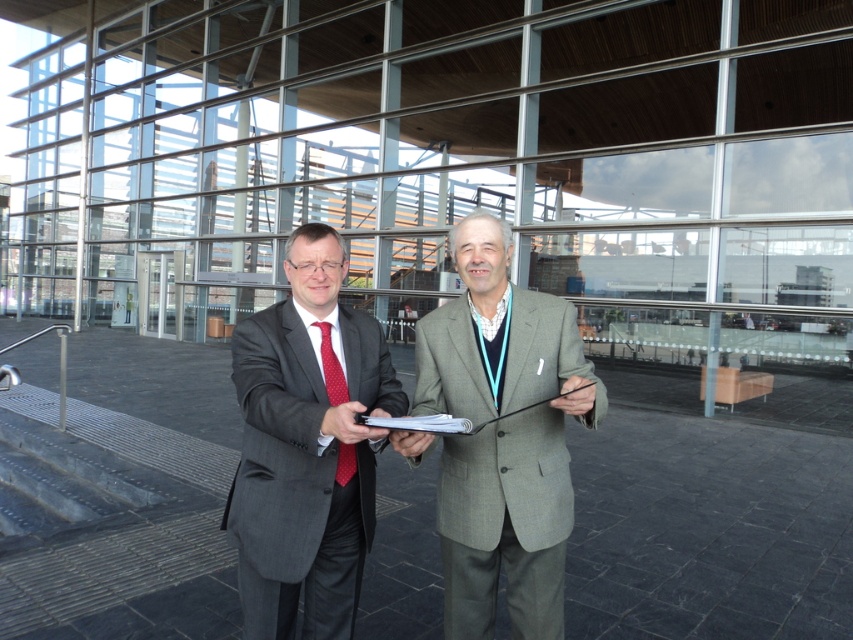
You are an observer standing in front of the modern building. You notice two people at the center. Which object is positioned lower between the matte gray suit at center and the red dotted tie at center?

The matte gray suit at center is positioned below the red dotted tie at center, so the matte gray suit at center is lower.

You are an observer looking at the two individuals in the scene. Which of the two suits, the gray wool suit at center or the matte gray suit at center, is positioned higher in the image?

The gray wool suit at center is located above the matte gray suit at center, so it is positioned higher in the image.